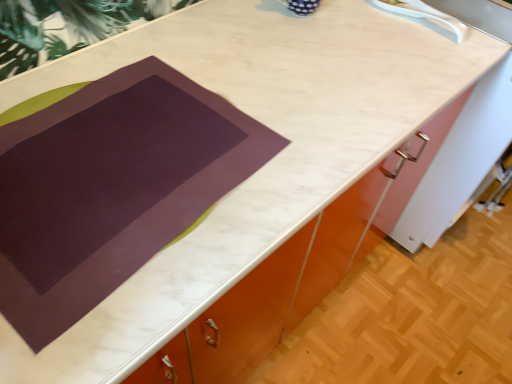
Image resolution: width=512 pixels, height=384 pixels. What are the coordinates of `free spot to the left of white plastic sink at upper right` in the screenshot? It's located at (352, 23).